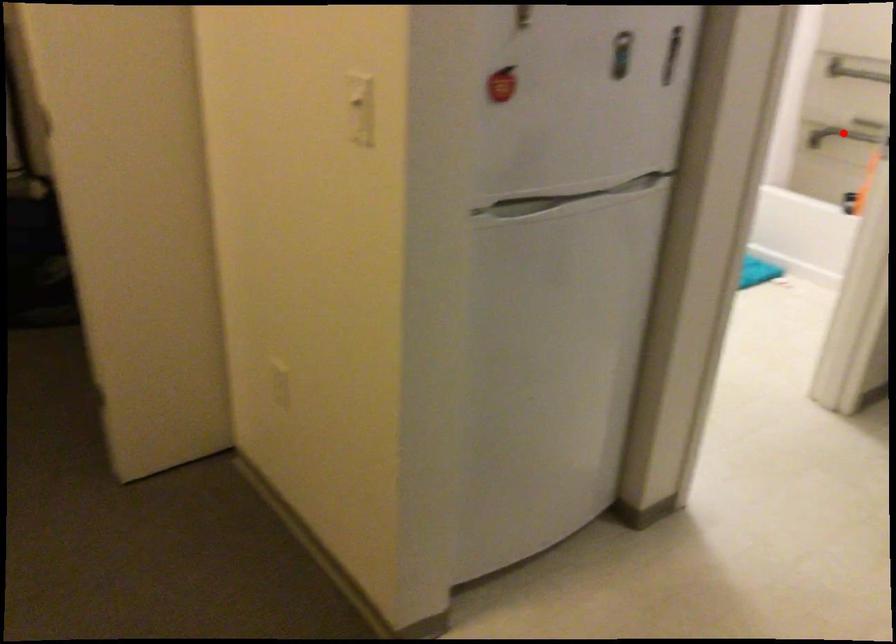
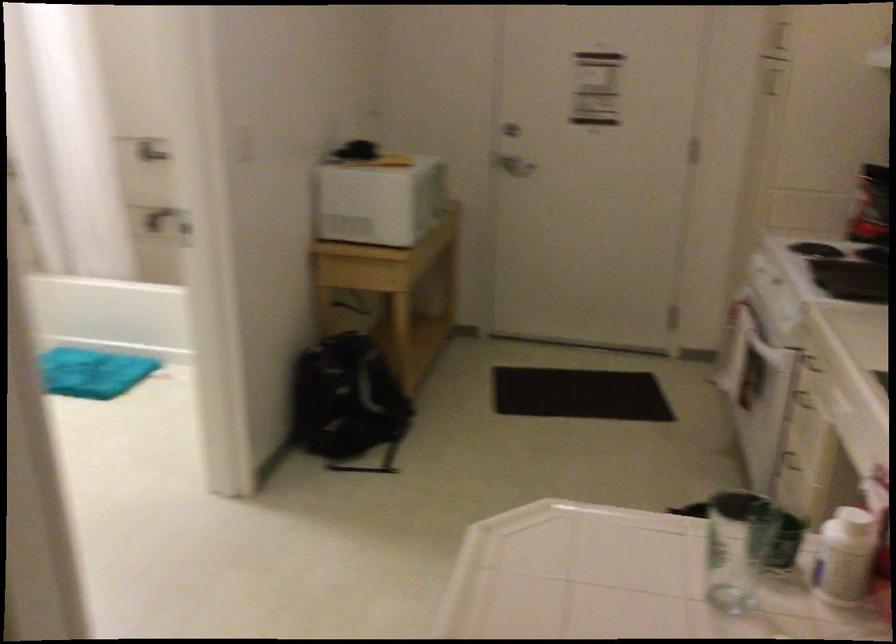
Question: I am providing you with two images of the same scene from different viewpoints. A red point is marked on the first image. At the location where the point appears in image 1, is it still visible in image 2?

Choices:
 (A) Yes
 (B) No

Answer: (B)